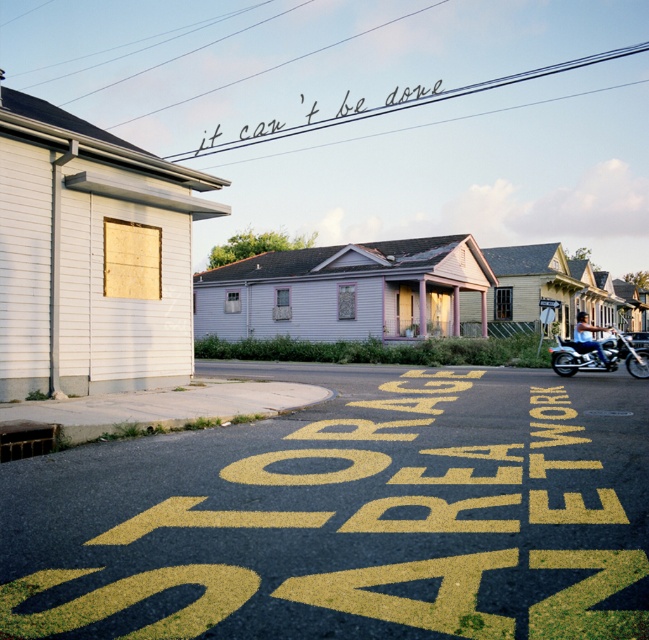
Who is lower down, yellow asphalt at center or black ink writing at upper center?

yellow asphalt at center is below.

Does yellow asphalt at center come in front of black ink writing at upper center?

Yes, it is.

Identify the location of yellow asphalt at center. (349, 516).

Image resolution: width=649 pixels, height=640 pixels. I want to click on yellow asphalt at center, so click(349, 516).

Find the location of `yellow asphalt at center`. yellow asphalt at center is located at coordinates (349, 516).

Between point (530, 529) and point (561, 346), which one is positioned in front?

Point (530, 529)

The image size is (649, 640). I want to click on yellow asphalt at center, so click(x=349, y=516).

Between shiny chrome motorcycle at right and black ink writing at upper center, which one appears on the left side from the viewer's perspective?

black ink writing at upper center

Where is `shiny chrome motorcycle at right`? The height and width of the screenshot is (640, 649). shiny chrome motorcycle at right is located at coordinates (598, 356).

Where is `shiny chrome motorcycle at right`? shiny chrome motorcycle at right is located at coordinates (598, 356).